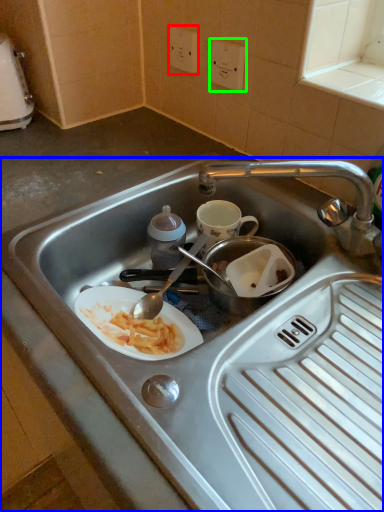
Question: Based on their relative distances, which object is farther from electric outlet (highlighted by a red box)? Choose from sink (highlighted by a blue box) and electric outlet (highlighted by a green box).

Choices:
 (A) sink
 (B) electric outlet

Answer: (A)